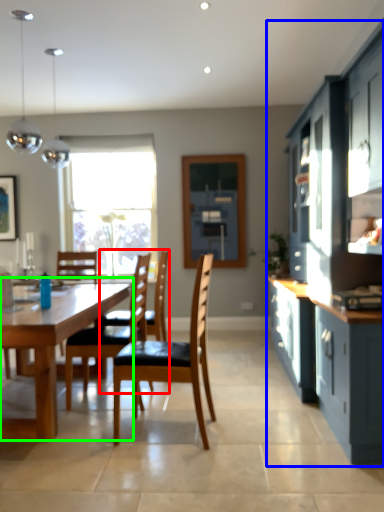
Question: Considering the real-world distances, which object is closest to chair (highlighted by a red box)? cabinetry (highlighted by a blue box) or kitchen & dining room table (highlighted by a green box).

Choices:
 (A) cabinetry
 (B) kitchen & dining room table

Answer: (B)